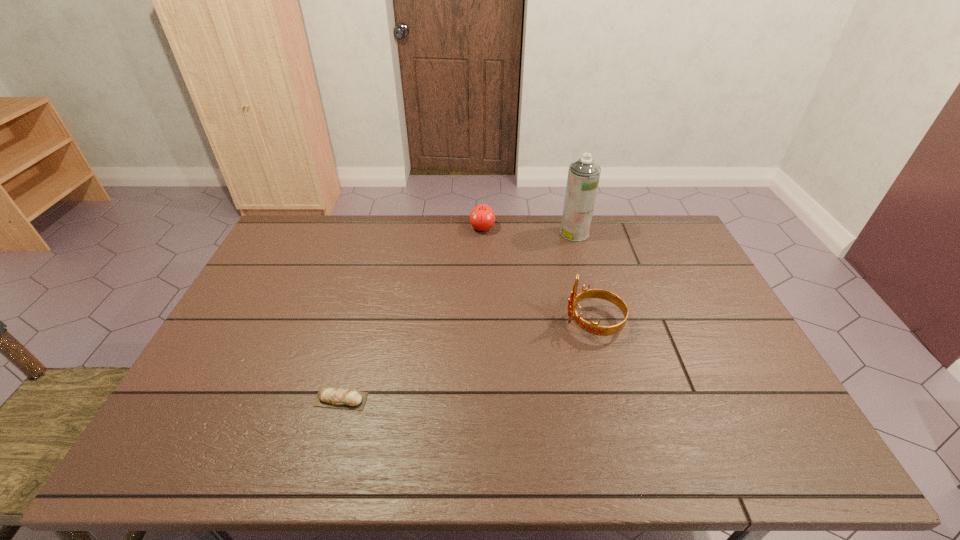
You are a GUI agent. You are given a task and a screenshot of the screen. Output one action in this format:
    pyautogui.click(x=<x>, y=<y>)
    Task: Click on the free space at the near right corner of the desktop
    This screenshot has width=960, height=540.
    Given the screenshot: What is the action you would take?
    pyautogui.click(x=781, y=439)

The width and height of the screenshot is (960, 540). What are the coordinates of `free space between the third farthest object and the second shortest object` in the screenshot? It's located at (538, 275).

Where is `vacant area that lies between the tallest object and the third farthest object`? Image resolution: width=960 pixels, height=540 pixels. vacant area that lies between the tallest object and the third farthest object is located at coordinates (584, 278).

Image resolution: width=960 pixels, height=540 pixels. I want to click on vacant space that's between the third tallest object and the tallest object, so click(528, 231).

This screenshot has height=540, width=960. What are the coordinates of `free space between the aerosol can and the second nearest object` in the screenshot? It's located at (584, 278).

Where is `empty space between the tallest object and the tiara`? This screenshot has height=540, width=960. empty space between the tallest object and the tiara is located at coordinates (584, 278).

Image resolution: width=960 pixels, height=540 pixels. In order to click on vacant region between the third tallest object and the third farthest object in this screenshot , I will do `click(538, 275)`.

Identify the location of vacant area between the second shortest object and the shortest object. The width and height of the screenshot is (960, 540). (412, 314).

The image size is (960, 540). I want to click on free point between the second tallest object and the second object from left to right, so click(x=538, y=275).

You are a GUI agent. You are given a task and a screenshot of the screen. Output one action in this format:
    pyautogui.click(x=<x>, y=<y>)
    Task: Click on the free spot between the tallest object and the third shortest object
    
    Given the screenshot: What is the action you would take?
    pyautogui.click(x=584, y=278)